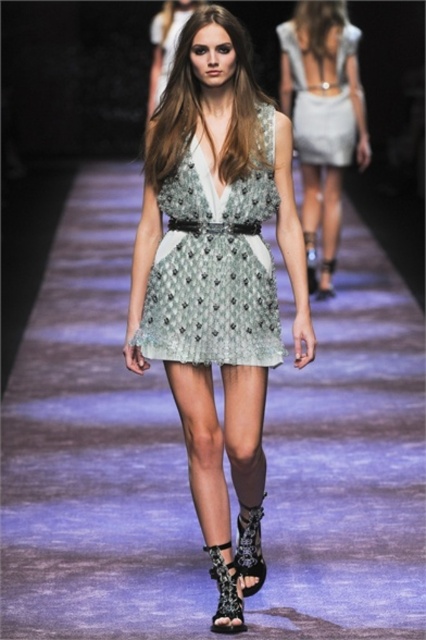
Does point (218, 561) lie in front of point (327, 292)?

Yes, it is in front of point (327, 292).

Between black lace sandal at lower center and leather lace-up sandal at center, which one is positioned lower?

black lace sandal at lower center

What do you see at coordinates (226, 593) in the screenshot? The width and height of the screenshot is (426, 640). I see `black lace sandal at lower center` at bounding box center [226, 593].

At what (x,y) coordinates should I click in order to perform the action: click on black lace sandal at lower center. Please return your answer as a coordinate pair (x, y). The width and height of the screenshot is (426, 640). Looking at the image, I should click on (226, 593).

Looking at this image, can you confirm if lace dress at center is positioned above satin dress at center?

No, lace dress at center is not above satin dress at center.

Between point (198, 28) and point (152, 84), which one is positioned in front?

Point (198, 28) is in front.

Locate an element on the screen. This screenshot has height=640, width=426. lace dress at center is located at coordinates (216, 260).

You are a GUI agent. You are given a task and a screenshot of the screen. Output one action in this format:
    pyautogui.click(x=<x>, y=<y>)
    Task: Click on the lace dress at center
    This screenshot has width=426, height=640.
    Given the screenshot: What is the action you would take?
    pyautogui.click(x=216, y=260)

Measure the distance from satin silver dress at center to light gray sheer fabric dress at upper center.

satin silver dress at center is 23.66 centimeters away from light gray sheer fabric dress at upper center.

In the scene shown: Who is lower down, satin silver dress at center or light gray sheer fabric dress at upper center?

satin silver dress at center is lower down.

This screenshot has height=640, width=426. In order to click on satin silver dress at center in this screenshot , I will do `click(322, 113)`.

I want to click on satin silver dress at center, so click(x=322, y=113).